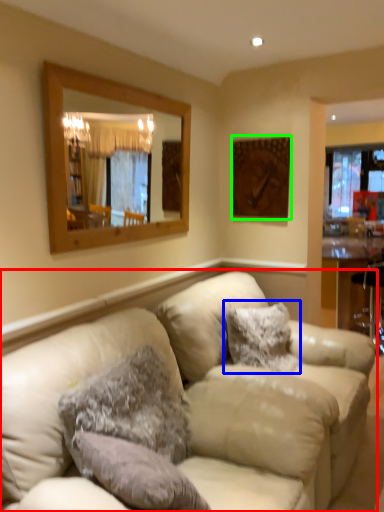
Question: Estimate the real-world distances between objects in this image. Which object is farther from studio couch (highlighted by a red box), pillow (highlighted by a blue box) or picture frame (highlighted by a green box)?

Choices:
 (A) pillow
 (B) picture frame

Answer: (B)